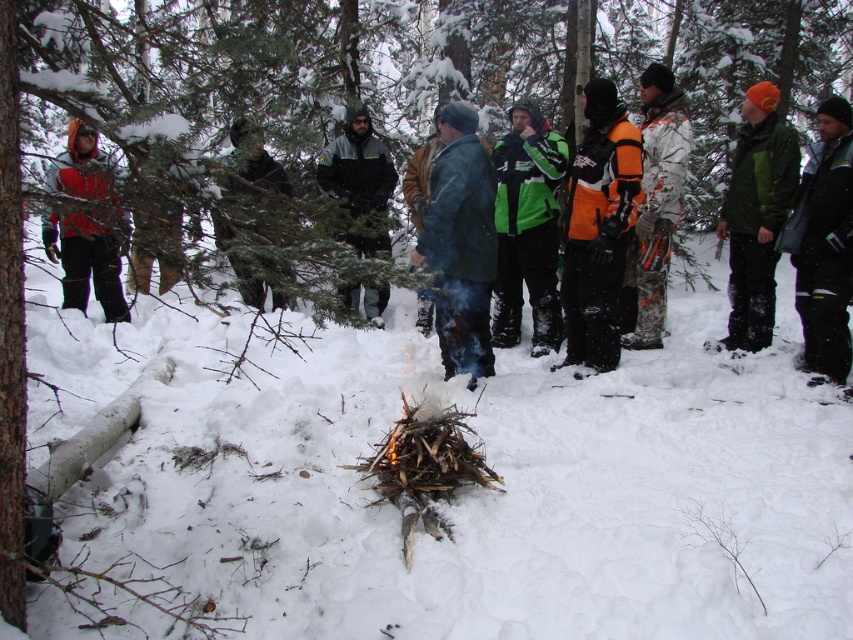
Question: Which point is farther from the camera taking this photo?

Choices:
 (A) (451, 371)
 (B) (654, 118)

Answer: (B)

Question: Considering the relative positions of blue denim jeans at center and orange fleece jacket at right in the image provided, where is blue denim jeans at center located with respect to orange fleece jacket at right?

Choices:
 (A) below
 (B) above

Answer: (A)

Question: Does orange and white snowsuit at center appear on the left side of orange fleece jacket at right?

Choices:
 (A) no
 (B) yes

Answer: (B)

Question: Does camouflage jacket at center have a smaller size compared to dark green jacket at center?

Choices:
 (A) yes
 (B) no

Answer: (B)

Question: Estimate the real-world distances between objects in this image. Which object is closer to the orange and white snowsuit at center?

Choices:
 (A) dark gray jacket at center
 (B) matte orange jacket at left
 (C) orange fleece jacket at right

Answer: (C)

Question: Which point is farther to the camera?

Choices:
 (A) orange fleece jacket at right
 (B) camouflage jacket at center
 (C) matte orange jacket at left

Answer: (B)